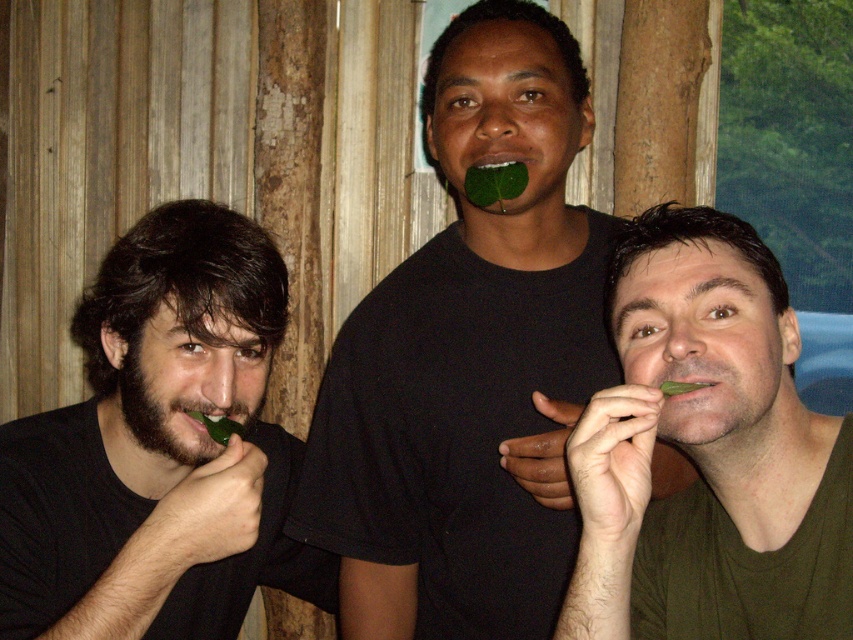
In the scene shown: You are a photographer trying to capture a candid shot of the two subjects in the scene. The green matte leaf at center and the dark brown hair at left are both in your viewfinder. Based on their heights, which one is more likely to block the view of the other if you position the camera at eye level?

The green matte leaf at center is much taller than the dark brown hair at left, so it would likely block the view of the dark brown hair at left if positioned at eye level.

Looking at this image, you are trying to determine which object is wider between the green matte leaf at center and the dark brown hair at left. Based on the scene, can you identify which one is wider?

The green matte leaf at center is wider than the dark brown hair at left according to the description.